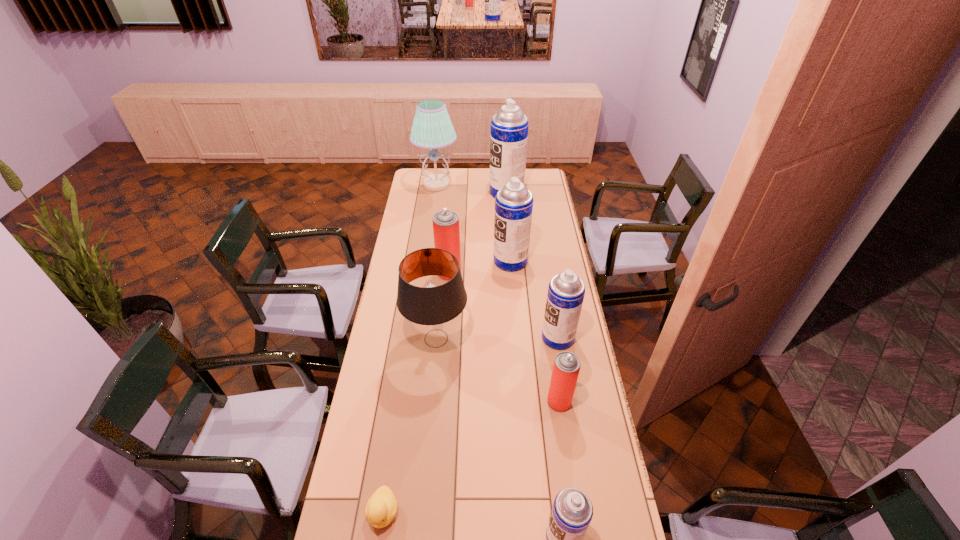
Locate an element on the screen. Image resolution: width=960 pixels, height=540 pixels. free space located on the right of the lampshade is located at coordinates (503, 339).

This screenshot has height=540, width=960. What are the coordinates of `vacant space located on the left of the leftmost aerosol can` in the screenshot? It's located at (421, 273).

What are the coordinates of `blank area located 0.060m on the label side of the second smallest blue aerosol can` in the screenshot? It's located at (527, 338).

Where is `vacant space located 0.100m on the label side of the second smallest blue aerosol can`? This screenshot has height=540, width=960. vacant space located 0.100m on the label side of the second smallest blue aerosol can is located at coordinates (516, 338).

Where is `free region located on the label side of the second smallest blue aerosol can`? The height and width of the screenshot is (540, 960). free region located on the label side of the second smallest blue aerosol can is located at coordinates (469, 338).

This screenshot has height=540, width=960. In order to click on vacant space located on the back of the second nearest aerosol can in this screenshot , I will do `click(551, 349)`.

Locate an element on the screen. This screenshot has width=960, height=540. aerosol can that is at the far edge is located at coordinates (509, 127).

The image size is (960, 540). Find the location of `lamp at the far edge`. lamp at the far edge is located at coordinates (432, 128).

Identify the location of lamp at the left edge. The width and height of the screenshot is (960, 540). (432, 128).

Find the location of a particular element. Image resolution: width=960 pixels, height=540 pixels. lampshade present at the left edge is located at coordinates (433, 312).